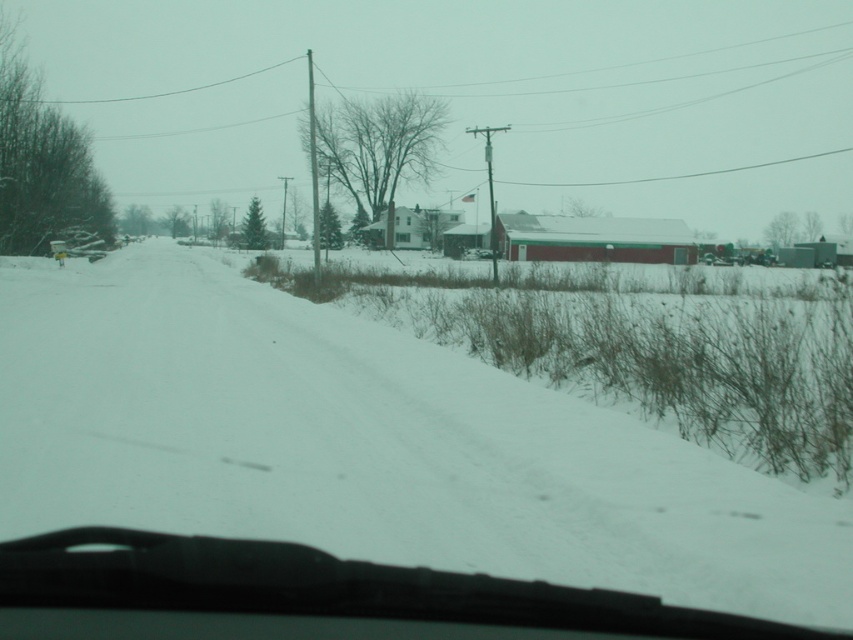
Does white powdery snow at center lie in front of transparent rubber windshield at center?

No, it is behind transparent rubber windshield at center.

Can you confirm if white powdery snow at center is wider than transparent rubber windshield at center?

Yes.

At what (x,y) coordinates should I click in order to perform the action: click on white powdery snow at center. Please return your answer as a coordinate pair (x, y). Looking at the image, I should click on (369, 445).

The height and width of the screenshot is (640, 853). In order to click on white powdery snow at center in this screenshot , I will do `click(369, 445)`.